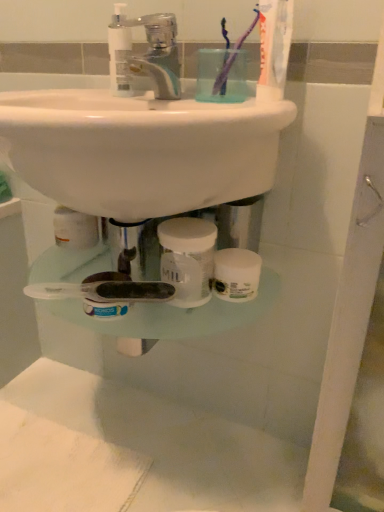
Where is `blank space to the left of clear plastic faucet at upper center`? This screenshot has height=512, width=384. blank space to the left of clear plastic faucet at upper center is located at coordinates (73, 97).